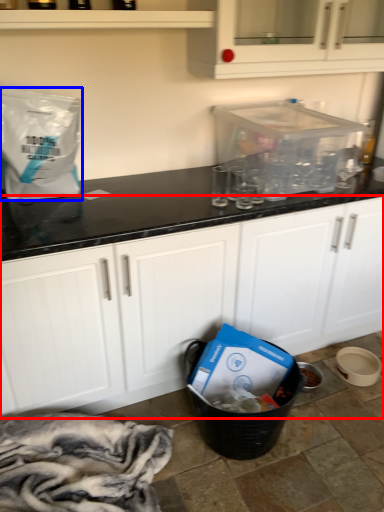
Question: Which object is further to the camera taking this photo, cabinetry (highlighted by a red box) or paper bag (highlighted by a blue box)?

Choices:
 (A) cabinetry
 (B) paper bag

Answer: (B)